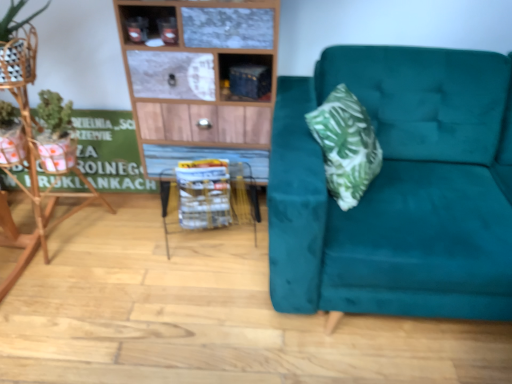
Question: Is metallic wireframe table at center located within teal velvet couch at right?

Choices:
 (A) yes
 (B) no

Answer: (B)

Question: Does teal velvet couch at right appear on the right side of metallic wireframe table at center?

Choices:
 (A) yes
 (B) no

Answer: (A)

Question: Is teal velvet couch at right looking in the opposite direction of metallic wireframe table at center?

Choices:
 (A) yes
 (B) no

Answer: (B)

Question: Is teal velvet couch at right placed right next to metallic wireframe table at center?

Choices:
 (A) no
 (B) yes

Answer: (A)

Question: Is teal velvet couch at right not close to metallic wireframe table at center?

Choices:
 (A) yes
 (B) no

Answer: (B)

Question: Considering the relative sizes of teal velvet couch at right and metallic wireframe table at center in the image provided, is teal velvet couch at right taller than metallic wireframe table at center?

Choices:
 (A) yes
 (B) no

Answer: (A)

Question: Does metallic blue cabinet at upper center have a smaller size compared to white plastic basket at center?

Choices:
 (A) yes
 (B) no

Answer: (A)

Question: Is metallic blue cabinet at upper center next to white plastic basket at center?

Choices:
 (A) yes
 (B) no

Answer: (B)

Question: Is metallic blue cabinet at upper center taller than white plastic basket at center?

Choices:
 (A) yes
 (B) no

Answer: (B)

Question: From a real-world perspective, is metallic blue cabinet at upper center over white plastic basket at center?

Choices:
 (A) yes
 (B) no

Answer: (A)

Question: Does metallic blue cabinet at upper center come behind white plastic basket at center?

Choices:
 (A) no
 (B) yes

Answer: (A)

Question: From the image's perspective, does metallic blue cabinet at upper center appear lower than white plastic basket at center?

Choices:
 (A) yes
 (B) no

Answer: (B)

Question: Can you confirm if metallic wireframe table at center is wider than metallic blue cabinet at upper center?

Choices:
 (A) yes
 (B) no

Answer: (A)